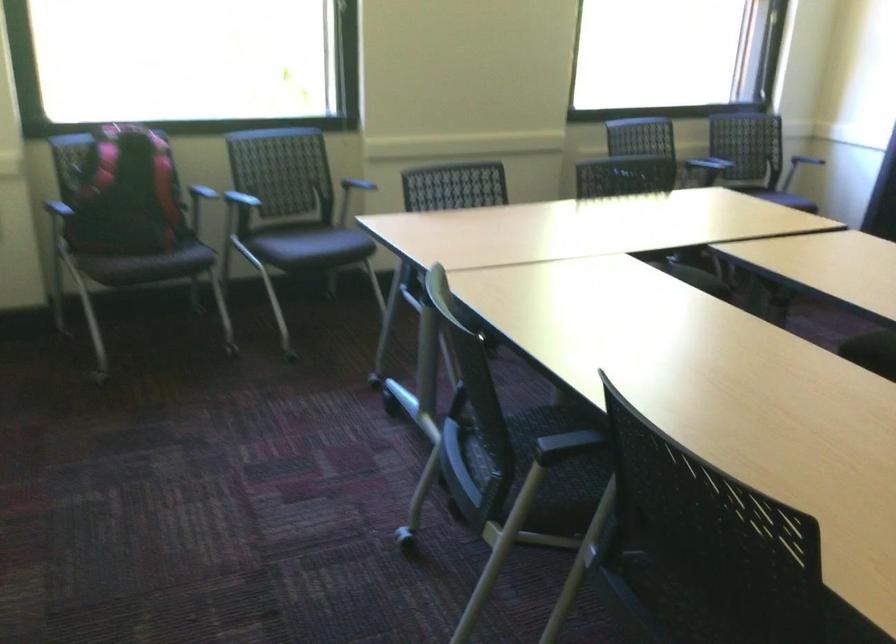
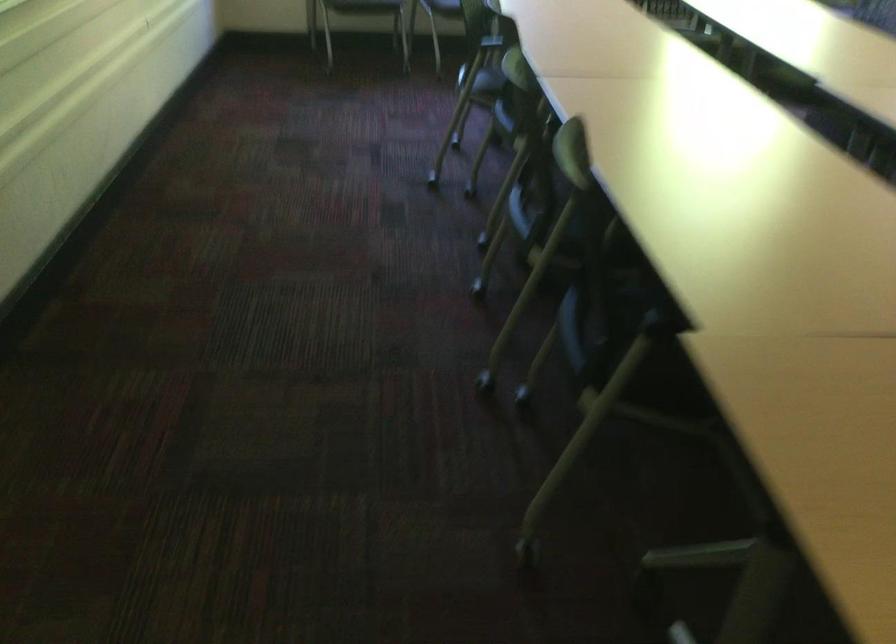
In a continuous first-person perspective shot, in which direction is the camera moving?

The cameraman moved toward right, backward.